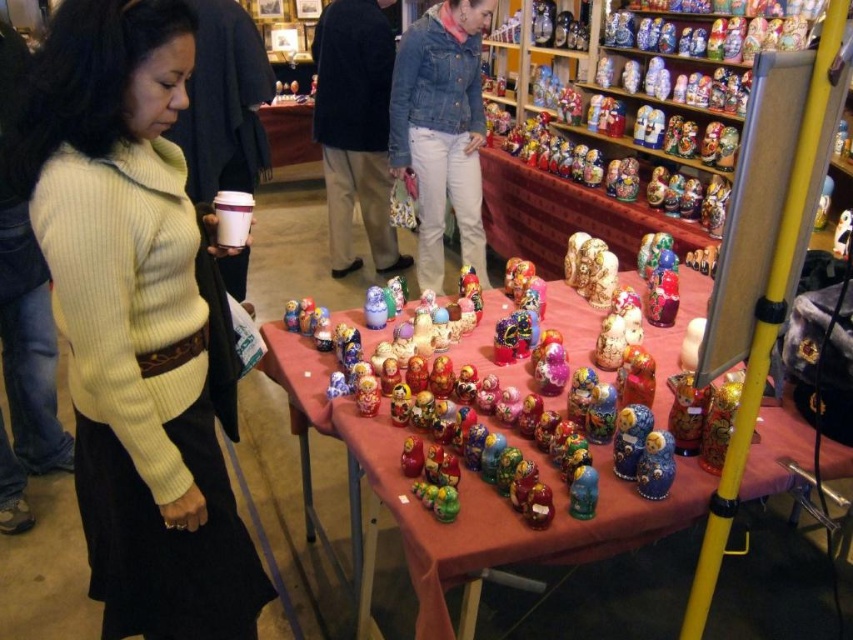
Question: Does ribbed knit sweater at left have a greater width compared to denim jacket at upper center?

Choices:
 (A) no
 (B) yes

Answer: (A)

Question: Is multicolored painted dolls at center closer to the viewer compared to denim jacket at center?

Choices:
 (A) yes
 (B) no

Answer: (A)

Question: Based on their relative distances, which object is farther from the denim jacket at upper center?

Choices:
 (A) ribbed knit sweater at left
 (B) multicolored painted dolls at center

Answer: (A)

Question: Which object is positioned closest to the ribbed knit sweater at left?

Choices:
 (A) denim jacket at upper center
 (B) shiny blue doll at center
 (C) denim jacket at center

Answer: (B)

Question: Which point appears closest to the camera in this image?

Choices:
 (A) (321, 90)
 (B) (692, 275)
 (C) (664, 449)

Answer: (C)

Question: Does ribbed knit sweater at left appear on the right side of blue glossy matryoshka doll at center?

Choices:
 (A) no
 (B) yes

Answer: (A)